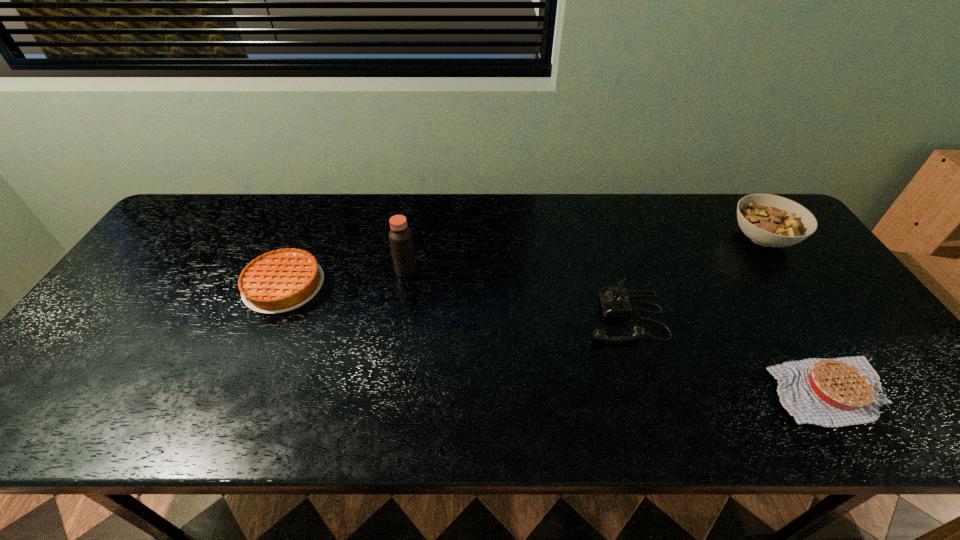
At what (x,y) coordinates should I click in order to perform the action: click on vacant area that satisfies the following two spatial constraints: 1. on the dial of the third object from right to left; 2. on the right side of the shorter pie. Please return your answer as a coordinate pair (x, y). The width and height of the screenshot is (960, 540). Looking at the image, I should click on (648, 392).